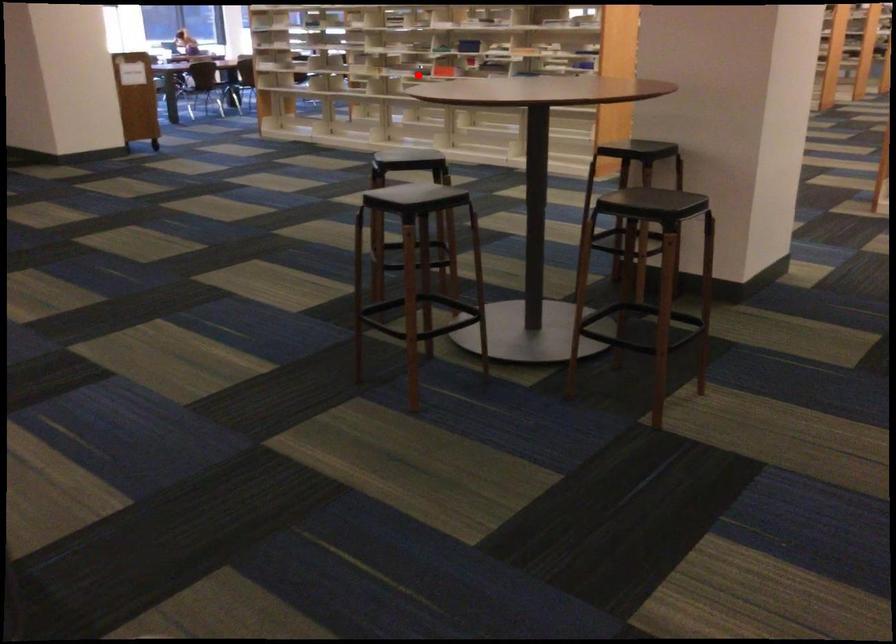
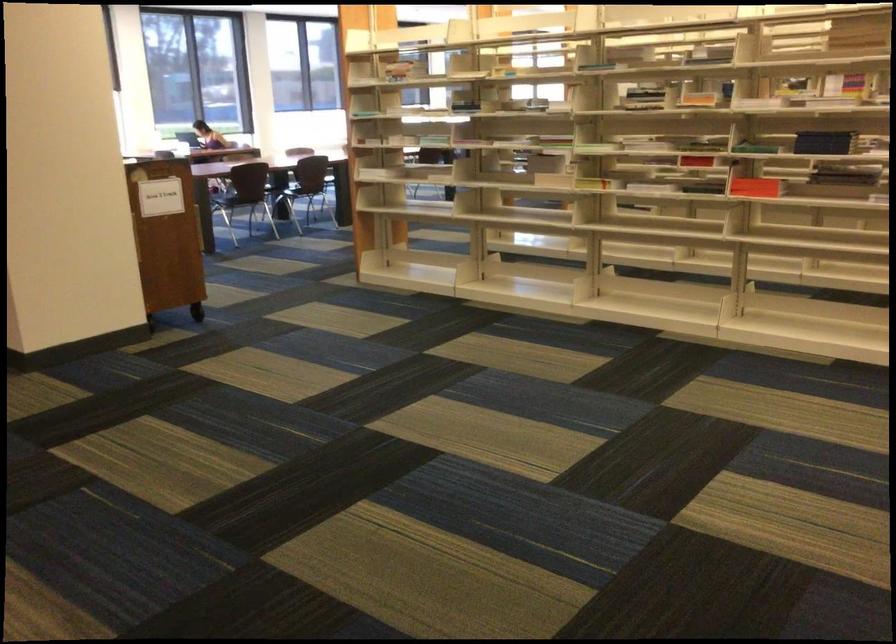
Question: I am providing you with two images of the same scene from different viewpoints. A red point is marked on the first image. Can you still see the location of the red point in image 2?

Choices:
 (A) Yes
 (B) No

Answer: (B)